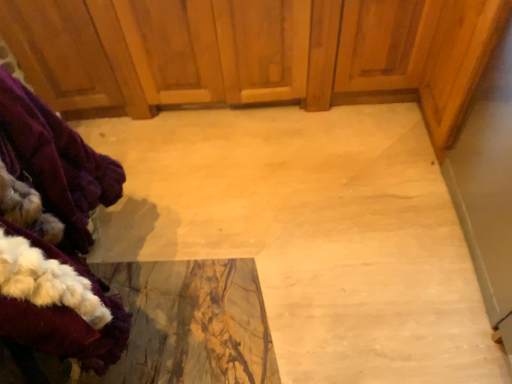
In order to click on wooden dresser at center in this screenshot , I will do (x=255, y=53).

Measure the distance between point (385, 46) and camera.

1.53 meters.

Describe the element at coordinates (255, 53) in the screenshot. Image resolution: width=512 pixels, height=384 pixels. I see `wooden dresser at center` at that location.

Measure the distance between point (51, 125) and camera.

Point (51, 125) is 85.90 centimeters from camera.

At what (x,y) coordinates should I click in order to perform the action: click on velvety purple coat at left. Please return your answer as a coordinate pair (x, y). The width and height of the screenshot is (512, 384). Looking at the image, I should click on (60, 220).

Image resolution: width=512 pixels, height=384 pixels. What do you see at coordinates (60, 220) in the screenshot? I see `velvety purple coat at left` at bounding box center [60, 220].

You are a GUI agent. You are given a task and a screenshot of the screen. Output one action in this format:
    pyautogui.click(x=<x>, y=<y>)
    Task: Click on the wooden dresser at center
    The image size is (512, 384).
    Given the screenshot: What is the action you would take?
    click(x=255, y=53)

Considering the positions of objects wooden dresser at center and velvety purple coat at left in the image provided, who is more to the right, wooden dresser at center or velvety purple coat at left?

wooden dresser at center is more to the right.

Is the depth of wooden dresser at center greater than that of velvety purple coat at left?

Yes, wooden dresser at center is further from the camera.

Which is further, (x=276, y=85) or (x=59, y=131)?

The point (x=276, y=85) is behind.

From the image's perspective, is wooden dresser at center located beneath velvety purple coat at left?

Incorrect, from the image's perspective, wooden dresser at center is higher than velvety purple coat at left.

From a real-world perspective, between wooden dresser at center and velvety purple coat at left, who is vertically lower?

In real-world perspective, wooden dresser at center is lower.

Based on the photo, considering the relative sizes of wooden dresser at center and velvety purple coat at left in the image provided, is wooden dresser at center thinner than velvety purple coat at left?

Incorrect, the width of wooden dresser at center is not less than that of velvety purple coat at left.

From their relative heights in the image, would you say wooden dresser at center is taller or shorter than velvety purple coat at left?

In the image, wooden dresser at center appears to be shorter than velvety purple coat at left.

Based on their sizes in the image, would you say wooden dresser at center is bigger or smaller than velvety purple coat at left?

wooden dresser at center is bigger than velvety purple coat at left.

Is wooden dresser at center situated inside velvety purple coat at left or outside?

wooden dresser at center exists outside the volume of velvety purple coat at left.

Is the surface of wooden dresser at center in direct contact with velvety purple coat at left?

wooden dresser at center and velvety purple coat at left are clearly separated.

Is wooden dresser at center positioned with its back to velvety purple coat at left?

That's not correct — wooden dresser at center is not looking away from velvety purple coat at left.

The width and height of the screenshot is (512, 384). I want to click on clothing to the left of wooden dresser at center, so click(60, 220).

Is velvety purple coat at left to the right of wooden dresser at center from the viewer's perspective?

No.

Is velvety purple coat at left further to camera compared to wooden dresser at center?

That is False.

Does point (76, 189) come closer to viewer compared to point (157, 22)?

Yes.

From the image's perspective, relative to wooden dresser at center, is velvety purple coat at left above or below?

velvety purple coat at left is situated lower than wooden dresser at center in the image.

From a real-world perspective, relative to wooden dresser at center, is velvety purple coat at left vertically above or below?

velvety purple coat at left is above wooden dresser at center.

Is velvety purple coat at left wider or thinner than wooden dresser at center?

velvety purple coat at left is thinner than wooden dresser at center.

Can you confirm if velvety purple coat at left is taller than wooden dresser at center?

Yes.

Does velvety purple coat at left have a smaller size compared to wooden dresser at center?

Indeed, velvety purple coat at left has a smaller size compared to wooden dresser at center.

Can wooden dresser at center be found inside velvety purple coat at left?

No.

Are velvety purple coat at left and wooden dresser at center located far from each other?

Actually, velvety purple coat at left and wooden dresser at center are a little close together.

Could you tell me if velvety purple coat at left is facing wooden dresser at center?

No, velvety purple coat at left is not facing towards wooden dresser at center.

The height and width of the screenshot is (384, 512). In order to click on clothing below the wooden dresser at center (from the image's perspective) in this screenshot , I will do pos(60,220).

At what (x,y) coordinates should I click in order to perform the action: click on clothing below the wooden dresser at center (from the image's perspective). Please return your answer as a coordinate pair (x, y). Looking at the image, I should click on (60, 220).

Find the location of `dresser located on the right of velvety purple coat at left`. dresser located on the right of velvety purple coat at left is located at coordinates (255, 53).